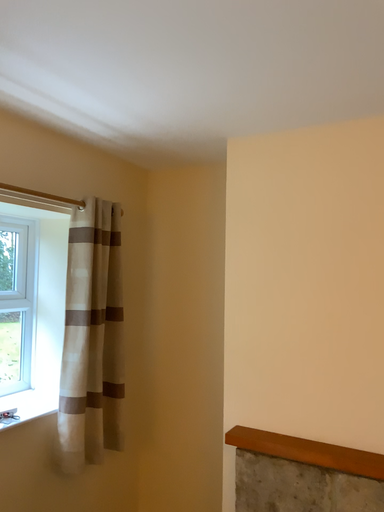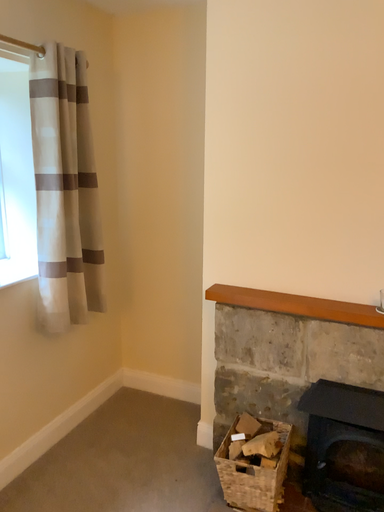
Question: How did the camera likely rotate when shooting the video?

Choices:
 (A) rotated upward
 (B) rotated downward

Answer: (B)